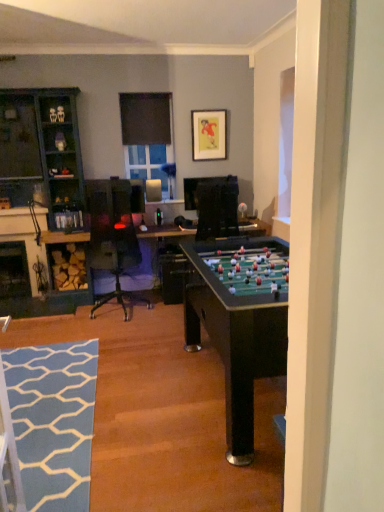
Question: Is clear glass window at upper center, the 2th window screen when ordered from top to bottom, not inside black matte window screen at upper center, the 1th window screen viewed from the top?

Choices:
 (A) yes
 (B) no

Answer: (A)

Question: From a real-world perspective, is clear glass window at upper center, the 2th window screen when ordered from top to bottom, below black matte window screen at upper center, the 1th window screen viewed from the top?

Choices:
 (A) yes
 (B) no

Answer: (A)

Question: Does clear glass window at upper center, which is the first window screen in bottom-to-top order, lie behind black matte window screen at upper center, the 1th window screen viewed from the top?

Choices:
 (A) yes
 (B) no

Answer: (A)

Question: From a real-world perspective, is clear glass window at upper center, the 2th window screen when ordered from top to bottom, on top of black matte window screen at upper center, which is counted as the 2th window screen, starting from the bottom?

Choices:
 (A) no
 (B) yes

Answer: (A)

Question: Is clear glass window at upper center, which is the first window screen in bottom-to-top order, bigger than black matte window screen at upper center, which is counted as the 2th window screen, starting from the bottom?

Choices:
 (A) no
 (B) yes

Answer: (B)

Question: From a real-world perspective, is black matte window screen at upper center, which is counted as the 2th window screen, starting from the bottom, positioned above or below clear glass window at upper center, which is the first window screen in bottom-to-top order?

Choices:
 (A) above
 (B) below

Answer: (A)

Question: Considering the positions of black matte window screen at upper center, which is counted as the 2th window screen, starting from the bottom, and clear glass window at upper center, which is the first window screen in bottom-to-top order, in the image, is black matte window screen at upper center, which is counted as the 2th window screen, starting from the bottom, bigger or smaller than clear glass window at upper center, which is the first window screen in bottom-to-top order,?

Choices:
 (A) big
 (B) small

Answer: (B)

Question: Is black matte window screen at upper center, which is counted as the 2th window screen, starting from the bottom, spatially inside clear glass window at upper center, the 2th window screen when ordered from top to bottom, or outside of it?

Choices:
 (A) outside
 (B) inside

Answer: (A)

Question: From the image's perspective, relative to clear glass window at upper center, the 2th window screen when ordered from top to bottom, is black matte window screen at upper center, which is counted as the 2th window screen, starting from the bottom, above or below?

Choices:
 (A) above
 (B) below

Answer: (A)

Question: Considering the positions of matte black picture frame at upper center and black matte window screen at upper center, the 1th window screen viewed from the top, in the image, is matte black picture frame at upper center wider or thinner than black matte window screen at upper center, the 1th window screen viewed from the top,?

Choices:
 (A) wide
 (B) thin

Answer: (B)

Question: Is point (210, 137) positioned closer to the camera than point (135, 135)?

Choices:
 (A) closer
 (B) farther

Answer: (B)

Question: In the image, is matte black picture frame at upper center on the left side or the right side of black matte window screen at upper center, which is counted as the 2th window screen, starting from the bottom?

Choices:
 (A) left
 (B) right

Answer: (B)

Question: From the image's perspective, relative to black matte window screen at upper center, the 1th window screen viewed from the top, is matte black picture frame at upper center above or below?

Choices:
 (A) above
 (B) below

Answer: (B)

Question: In the image, is teal wood cabinet at left on the left side or the right side of blue textured rug at lower left?

Choices:
 (A) right
 (B) left

Answer: (B)

Question: Based on their sizes in the image, would you say teal wood cabinet at left is bigger or smaller than blue textured rug at lower left?

Choices:
 (A) big
 (B) small

Answer: (A)